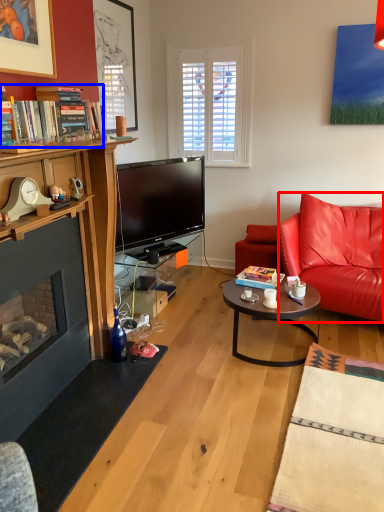
Question: Which object appears farthest to the camera in this image, cushion (highlighted by a red box) or book (highlighted by a blue box)?

Choices:
 (A) cushion
 (B) book

Answer: (A)